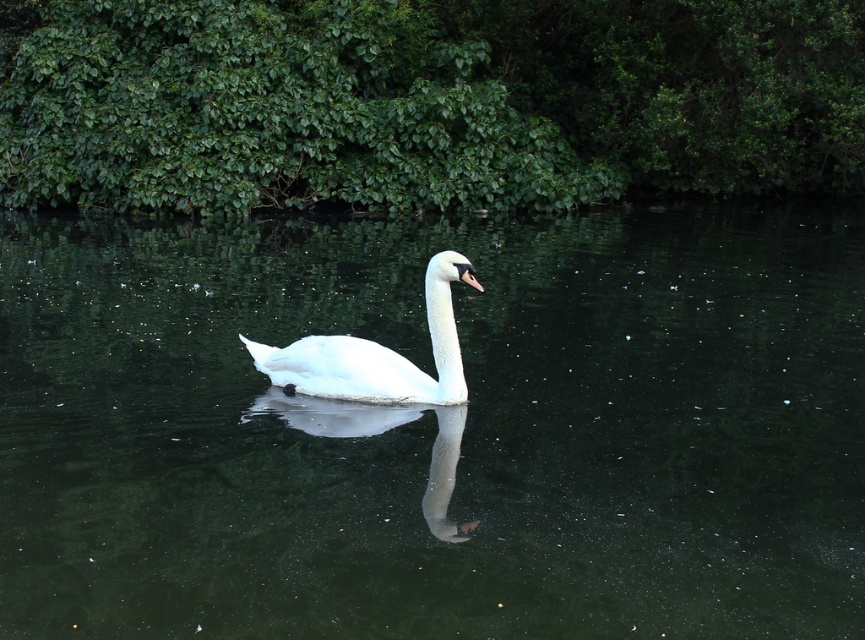
Who is positioned more to the right, clear dark water at center or white glossy swan at center?

From the viewer's perspective, clear dark water at center appears more on the right side.

Does point (548, 285) lie behind point (338, 372)?

Yes.

Is point (702, 410) closer to viewer compared to point (444, 300)?

No, (702, 410) is behind (444, 300).

Image resolution: width=865 pixels, height=640 pixels. Identify the location of clear dark water at center. (436, 428).